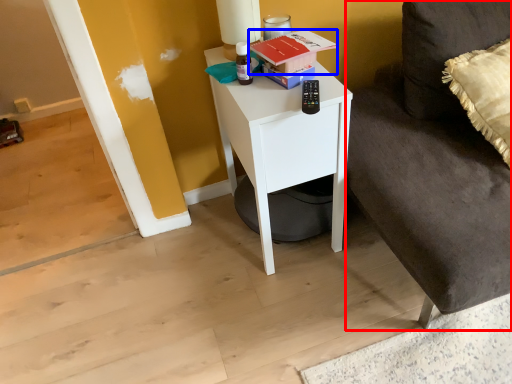
Question: Among these objects, which one is nearest to the camera, couch (highlighted by a red box) or book (highlighted by a blue box)?

Choices:
 (A) couch
 (B) book

Answer: (A)